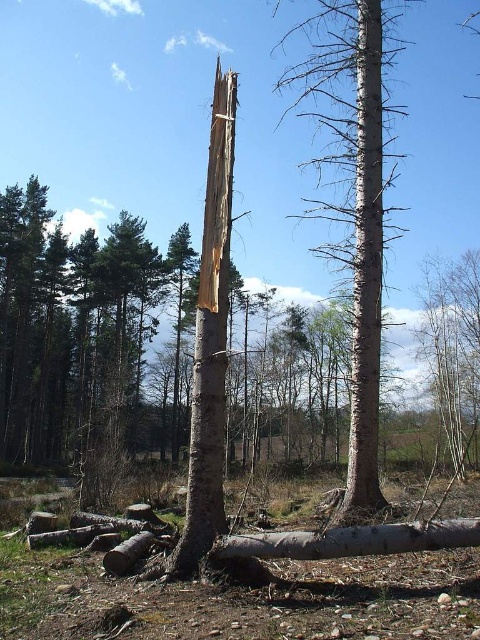
Question: Considering the relative positions of smooth gray bark tree at center and smooth white tree trunk at center in the image provided, where is smooth gray bark tree at center located with respect to smooth white tree trunk at center?

Choices:
 (A) below
 (B) above

Answer: (B)

Question: Among these points, which one is nearest to the camera?

Choices:
 (A) (206, 547)
 (B) (360, 376)
 (C) (357, 109)

Answer: (A)

Question: Which of the following is the farthest from the observer?

Choices:
 (A) bark at center
 (B) smooth gray bark tree at center
 (C) smooth white tree trunk at center

Answer: (B)

Question: Which of the following is the farthest from the observer?

Choices:
 (A) (363, 509)
 (B) (381, 308)
 (C) (230, 189)

Answer: (B)

Question: Can you confirm if smooth gray bark tree at center is smaller than smooth white tree trunk at center?

Choices:
 (A) yes
 (B) no

Answer: (B)

Question: Can you confirm if bark at center is positioned above smooth white tree trunk at center?

Choices:
 (A) no
 (B) yes

Answer: (B)